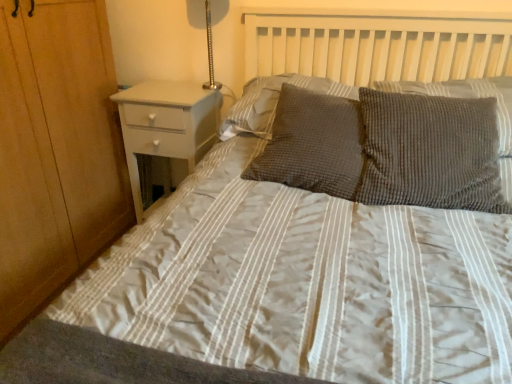
What is the approximate height of white glossy nightstand at left?

white glossy nightstand at left is 72.45 centimeters tall.

This screenshot has width=512, height=384. What do you see at coordinates (313, 144) in the screenshot? I see `textured gray pillow at center, marked as the 2th pillow in a left-to-right arrangement` at bounding box center [313, 144].

What do you see at coordinates (430, 152) in the screenshot? This screenshot has height=384, width=512. I see `textured gray pillow at center, which is counted as the second pillow, starting from the right` at bounding box center [430, 152].

The image size is (512, 384). What do you see at coordinates (272, 102) in the screenshot?
I see `textured gray pillow at center, the 1th pillow when ordered from left to right` at bounding box center [272, 102].

The width and height of the screenshot is (512, 384). What are the coordinates of `white glossy nightstand at left` in the screenshot? It's located at (166, 128).

Can we say textured gray pillow at center, marked as the 2th pillow in a left-to-right arrangement, lies outside textured gray pillow at center, the 1th pillow when ordered from left to right?

textured gray pillow at center, marked as the 2th pillow in a left-to-right arrangement, lies outside textured gray pillow at center, the 1th pillow when ordered from left to right,'s area.

Is textured gray pillow at center, the third pillow positioned from the right, thinner than textured gray pillow at center, the 1th pillow when ordered from left to right?

No, textured gray pillow at center, the third pillow positioned from the right, is not thinner than textured gray pillow at center, the 1th pillow when ordered from left to right.

Between textured gray pillow at center, marked as the 2th pillow in a left-to-right arrangement, and textured gray pillow at center, the 1th pillow when ordered from left to right, which one has larger size?

Bigger between the two is textured gray pillow at center, the 1th pillow when ordered from left to right.

Does textured gray pillow at center, the third pillow positioned from the right, appear on the left side of textured gray pillow at center, arranged as the 4th pillow when viewed from the right?

No.

This screenshot has height=384, width=512. In order to click on pillow on the right of textured gray pillow at center, acting as the 3th pillow starting from the left in this screenshot , I will do `click(467, 97)`.

Based on the photo, is textured gray pillow at center, marked as the 4th pillow in a left-to-right arrangement, bigger or smaller than textured gray pillow at center, acting as the 3th pillow starting from the left?

textured gray pillow at center, marked as the 4th pillow in a left-to-right arrangement, is smaller than textured gray pillow at center, acting as the 3th pillow starting from the left.

Can we say textured gray pillow at center, marked as the 4th pillow in a left-to-right arrangement, lies outside textured gray pillow at center, acting as the 3th pillow starting from the left?

Yes, textured gray pillow at center, marked as the 4th pillow in a left-to-right arrangement, is located beyond the bounds of textured gray pillow at center, acting as the 3th pillow starting from the left.

In the image, is textured gray pillow at center, arranged as the 4th pillow when viewed from the right, positioned in front of or behind textured gray pillow at center, which is counted as the second pillow, starting from the right?

textured gray pillow at center, arranged as the 4th pillow when viewed from the right, is positioned farther from the viewer than textured gray pillow at center, which is counted as the second pillow, starting from the right.

Is there a large distance between textured gray pillow at center, the 1th pillow when ordered from left to right, and textured gray pillow at center, which is counted as the second pillow, starting from the right?

They are positioned close to each other.

The image size is (512, 384). Find the location of `the 3rd pillow in front of the textured gray pillow at center, arranged as the 4th pillow when viewed from the right`. the 3rd pillow in front of the textured gray pillow at center, arranged as the 4th pillow when viewed from the right is located at coordinates (430, 152).

Is textured gray pillow at center, arranged as the 4th pillow when viewed from the right, at the left side of textured gray pillow at center, acting as the 3th pillow starting from the left?

Correct, you'll find textured gray pillow at center, arranged as the 4th pillow when viewed from the right, to the left of textured gray pillow at center, acting as the 3th pillow starting from the left.

Could you tell me if white glossy nightstand at left is turned towards textured gray pillow at center, marked as the 4th pillow in a left-to-right arrangement?

No, white glossy nightstand at left is not oriented towards textured gray pillow at center, marked as the 4th pillow in a left-to-right arrangement.

Based on the photo, considering the relative positions of white glossy nightstand at left and textured gray pillow at center, marked as the 4th pillow in a left-to-right arrangement, in the image provided, is white glossy nightstand at left to the left or to the right of textured gray pillow at center, marked as the 4th pillow in a left-to-right arrangement,?

Clearly, white glossy nightstand at left is on the left of textured gray pillow at center, marked as the 4th pillow in a left-to-right arrangement, in the image.

From a real-world perspective, who is located lower, white glossy nightstand at left or textured gray pillow at center, marked as the 4th pillow in a left-to-right arrangement?

white glossy nightstand at left.

Based on the photo, which object is further away from the camera, white glossy nightstand at left or textured gray pillow at center, marked as the 4th pillow in a left-to-right arrangement?

white glossy nightstand at left is further away from the camera.

Is metallic silver lamp at upper right not inside textured gray pillow at center, marked as the 4th pillow in a left-to-right arrangement?

metallic silver lamp at upper right is positioned outside textured gray pillow at center, marked as the 4th pillow in a left-to-right arrangement.

From a real-world perspective, is metallic silver lamp at upper right beneath textured gray pillow at center, marked as the 4th pillow in a left-to-right arrangement?

No.

From the image's perspective, is metallic silver lamp at upper right on top of textured gray pillow at center, marked as the 4th pillow in a left-to-right arrangement?

Yes, from the image's perspective, metallic silver lamp at upper right is over textured gray pillow at center, marked as the 4th pillow in a left-to-right arrangement.

Is white glossy nightstand at left positioned far away from textured gray pillow at center, which is counted as the second pillow, starting from the right?

No, white glossy nightstand at left is not far away from textured gray pillow at center, which is counted as the second pillow, starting from the right.

Is white glossy nightstand at left surrounding textured gray pillow at center, acting as the 3th pillow starting from the left?

No, white glossy nightstand at left does not contain textured gray pillow at center, acting as the 3th pillow starting from the left.

Which object is further away from the camera taking this photo, white glossy nightstand at left or textured gray pillow at center, acting as the 3th pillow starting from the left?

white glossy nightstand at left.

Does white glossy nightstand at left appear on the left side of textured gray pillow at center, which is counted as the second pillow, starting from the right?

Yes, white glossy nightstand at left is to the left of textured gray pillow at center, which is counted as the second pillow, starting from the right.

Does textured gray pillow at center, marked as the 4th pillow in a left-to-right arrangement, touch textured gray pillow at center, arranged as the 4th pillow when viewed from the right?

No, textured gray pillow at center, marked as the 4th pillow in a left-to-right arrangement, is not beside textured gray pillow at center, arranged as the 4th pillow when viewed from the right.

Who is shorter, textured gray pillow at center, marked as the 4th pillow in a left-to-right arrangement, or textured gray pillow at center, the 1th pillow when ordered from left to right?

With less height is textured gray pillow at center, marked as the 4th pillow in a left-to-right arrangement.

Is textured gray pillow at center, the 1th pillow when ordered from left to right, completely or partially inside textured gray pillow at center, marked as the 4th pillow in a left-to-right arrangement?

No, textured gray pillow at center, the 1th pillow when ordered from left to right, is not surrounded by textured gray pillow at center, marked as the 4th pillow in a left-to-right arrangement.

This screenshot has width=512, height=384. There is a textured gray pillow at center, the 1th pillow when ordered from left to right. Identify the location of the 2nd pillow below it (from the image's perspective). (313, 144).

This screenshot has height=384, width=512. I want to click on the 2nd pillow behind the textured gray pillow at center, which is counted as the second pillow, starting from the right, so click(467, 97).

Looking at the image, which one is located further to metallic silver lamp at upper right, white glossy nightstand at left or textured gray pillow at center, the 1th pillow when ordered from left to right?

textured gray pillow at center, the 1th pillow when ordered from left to right, is positioned further to the anchor metallic silver lamp at upper right.

Which object lies nearer to the anchor point textured gray pillow at center, marked as the 2th pillow in a left-to-right arrangement, textured gray pillow at center, the 1th pillow when ordered from left to right, or textured gray pillow at center, which is counted as the second pillow, starting from the right?

Among the two, textured gray pillow at center, which is counted as the second pillow, starting from the right, is located nearer to textured gray pillow at center, marked as the 2th pillow in a left-to-right arrangement.

Based on their spatial positions, is textured gray pillow at center, which is counted as the second pillow, starting from the right, or metallic silver lamp at upper right closer to textured gray pillow at center, acting as the 1th pillow starting from the right?

textured gray pillow at center, which is counted as the second pillow, starting from the right.

Considering their positions, is metallic silver lamp at upper right positioned closer to white glossy nightstand at left than textured gray pillow at center, which is counted as the second pillow, starting from the right?

Based on the image, metallic silver lamp at upper right appears to be nearer to white glossy nightstand at left.

Considering their positions, is textured gray pillow at center, marked as the 2th pillow in a left-to-right arrangement, positioned closer to white glossy nightstand at left than metallic silver lamp at upper right?

metallic silver lamp at upper right lies closer to white glossy nightstand at left than the other object.

Looking at the image, which one is located closer to white glossy nightstand at left, metallic silver lamp at upper right or textured gray pillow at center, marked as the 4th pillow in a left-to-right arrangement?

The object closer to white glossy nightstand at left is metallic silver lamp at upper right.

When comparing their distances from textured gray pillow at center, the 1th pillow when ordered from left to right, does textured gray pillow at center, acting as the 3th pillow starting from the left, or textured gray pillow at center, the third pillow positioned from the right, seem further?

Based on the image, textured gray pillow at center, acting as the 3th pillow starting from the left, appears to be further to textured gray pillow at center, the 1th pillow when ordered from left to right.

Estimate the real-world distances between objects in this image. Which object is further from white glossy nightstand at left, textured gray pillow at center, arranged as the 4th pillow when viewed from the right, or textured gray pillow at center, acting as the 1th pillow starting from the right?

Based on the image, textured gray pillow at center, acting as the 1th pillow starting from the right, appears to be further to white glossy nightstand at left.

What are the coordinates of `pillow located between textured gray pillow at center, the 1th pillow when ordered from left to right, and textured gray pillow at center, which is counted as the second pillow, starting from the right, in the left-right direction` in the screenshot? It's located at (313, 144).

Locate an element on the screen. Image resolution: width=512 pixels, height=384 pixels. pillow situated between white glossy nightstand at left and textured gray pillow at center, the third pillow positioned from the right, from left to right is located at coordinates (272, 102).

Find the location of a particular element. This screenshot has height=384, width=512. bedside lamp between white glossy nightstand at left and textured gray pillow at center, acting as the 1th pillow starting from the right, from left to right is located at coordinates (206, 32).

Locate an element on the screen. Image resolution: width=512 pixels, height=384 pixels. bedside lamp between white glossy nightstand at left and textured gray pillow at center, acting as the 3th pillow starting from the left, from left to right is located at coordinates (206, 32).